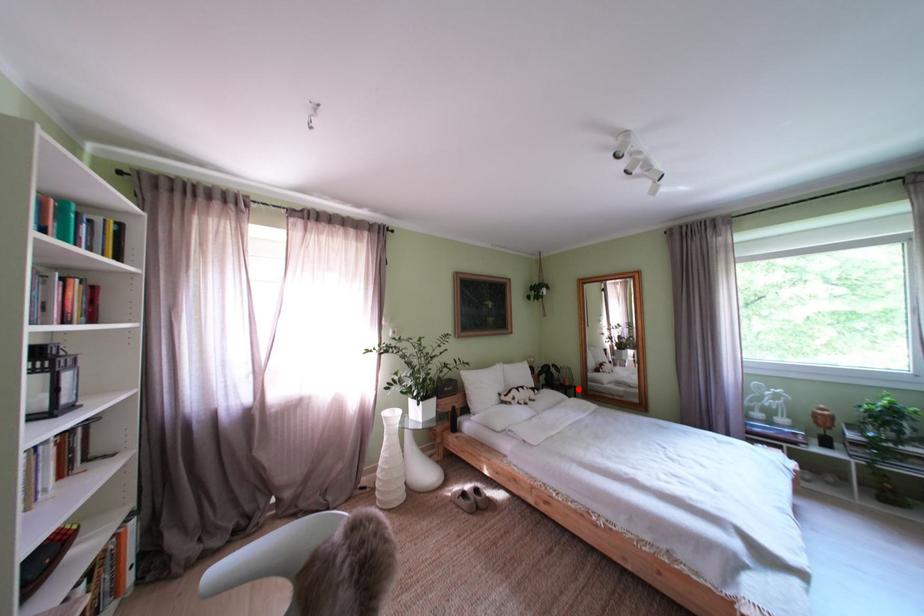
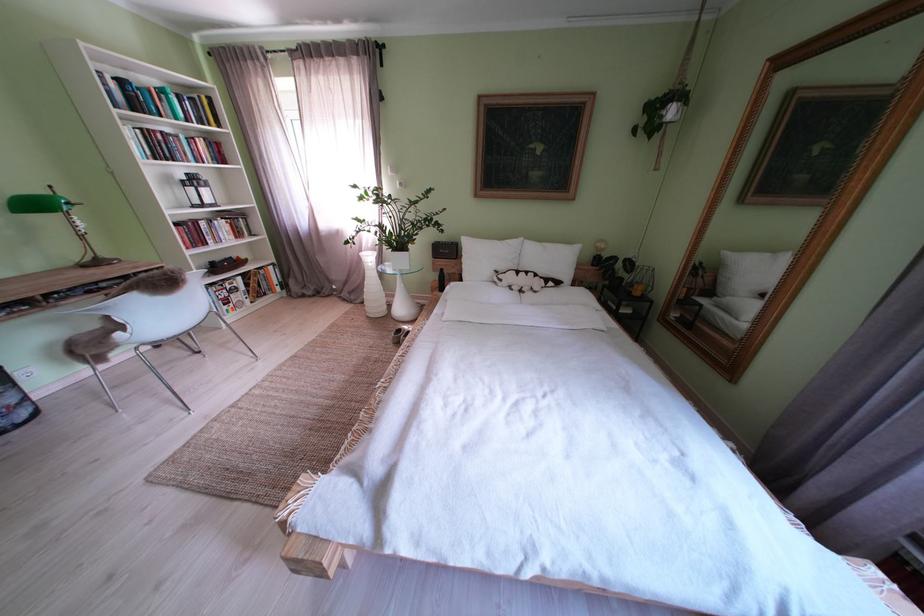
Find the pixel in the second image that matches the highlighted location in the first image.

(648, 299)